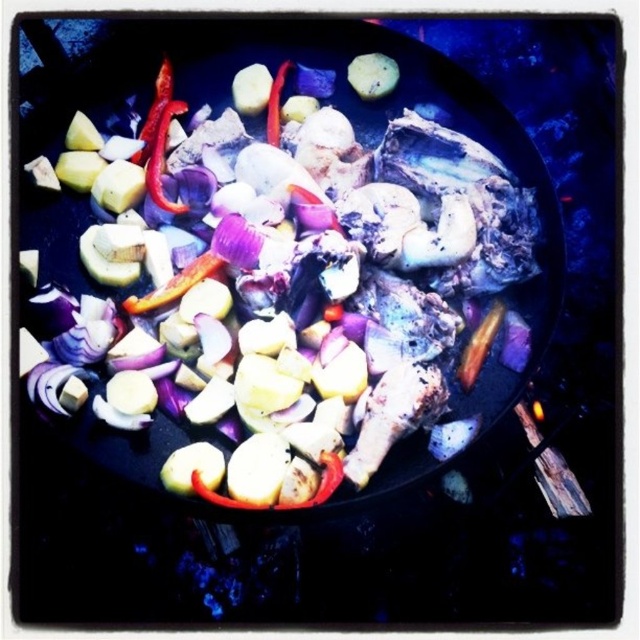
Question: Among these objects, which one is nearest to the camera?

Choices:
 (A) glossy red pepper at upper left
 (B) black matte wok at center

Answer: (B)

Question: Which of the following is the farthest from the observer?

Choices:
 (A) (156, 156)
 (B) (550, 218)

Answer: (A)

Question: Does black matte wok at center have a smaller size compared to glossy red pepper at upper left?

Choices:
 (A) yes
 (B) no

Answer: (B)

Question: From the image, what is the correct spatial relationship of black matte wok at center in relation to glossy red pepper at upper left?

Choices:
 (A) left
 (B) right

Answer: (B)

Question: Is black matte wok at center below glossy red pepper at upper left?

Choices:
 (A) no
 (B) yes

Answer: (B)

Question: Which point is closer to the camera?

Choices:
 (A) (148, 184)
 (B) (240, 74)

Answer: (A)